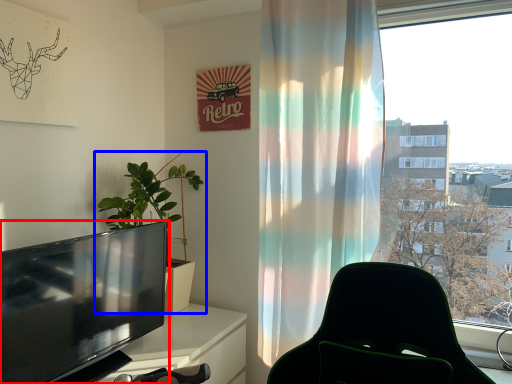
Question: Which object appears farthest to the camera in this image, television (highlighted by a red box) or houseplant (highlighted by a blue box)?

Choices:
 (A) television
 (B) houseplant

Answer: (B)